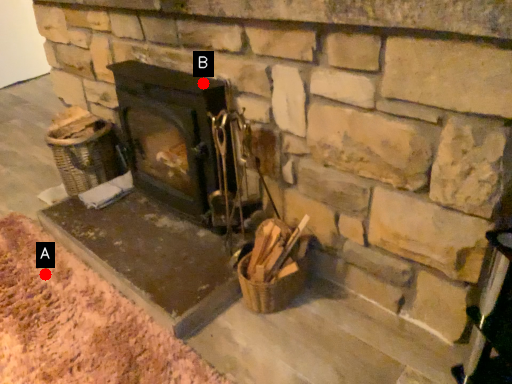
Question: Two points are circled on the image, labeled by A and B beside each circle. Which point appears closest to the camera in this image?

Choices:
 (A) A is closer
 (B) B is closer

Answer: (B)